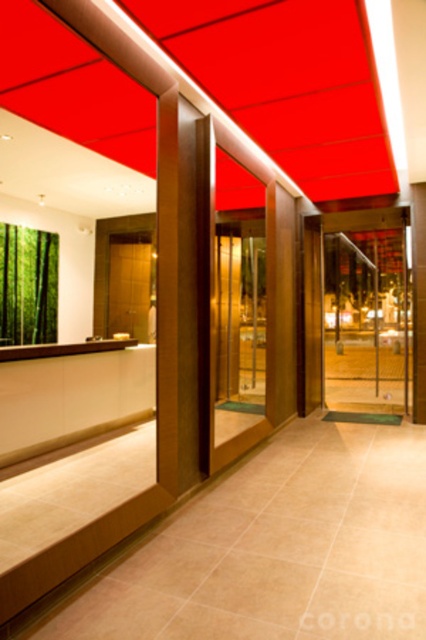
You are a delivery person entering the building and need to access the glass door. The green bamboo curtain is blocking your path. Can you walk through the space between the transparent glass door at center and the green bamboo curtain at left without bending down?

The transparent glass door at center is shorter than the green bamboo curtain at left, so the height of the transparent glass door at center may not be sufficient to allow you to pass through without bending down. You might need to lower your head or bend slightly to avoid hitting your head on the door frame.

You are designing a layout for a new office space and need to place both the transparent glass door at center and the green bamboo curtain at left in a narrow hallway. Given their sizes, which object should you place closer to the entrance to ensure there is enough space for people to pass through comfortably?

The transparent glass door at center occupies less space than the green bamboo curtain at left, so placing the transparent glass door at center closer to the entrance would leave more space for people to pass through comfortably.